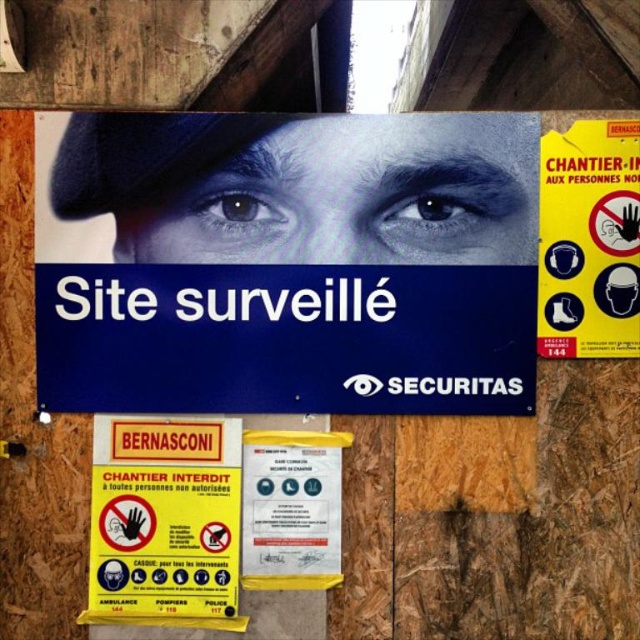
Question: Which point is closer to the camera?

Choices:
 (A) (157, 579)
 (B) (604, 224)
 (C) (257, 499)

Answer: (B)

Question: Does yellow paper sign at upper right appear on the right side of yellow paper at center?

Choices:
 (A) no
 (B) yes

Answer: (B)

Question: Is yellow paper sign at upper right below yellow paper sign at lower left?

Choices:
 (A) no
 (B) yes

Answer: (A)

Question: Which of the following is the closest to the observer?

Choices:
 (A) yellow paper sign at upper right
 (B) yellow paper at center
 (C) yellow paper sign at lower left

Answer: (A)

Question: Considering the relative positions of yellow paper sign at upper right and yellow paper sign at lower left in the image provided, where is yellow paper sign at upper right located with respect to yellow paper sign at lower left?

Choices:
 (A) left
 (B) right

Answer: (B)

Question: Which of these objects is positioned closest to the yellow paper sign at lower left?

Choices:
 (A) yellow paper at center
 (B) yellow paper sign at upper right

Answer: (A)